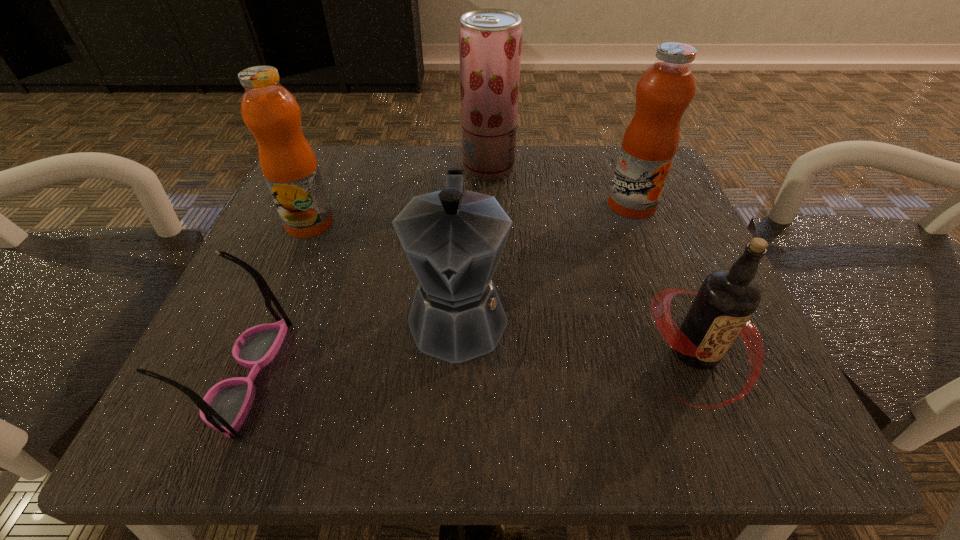
Where is `free space located 0.050m at the spout of the coffeepot`? The width and height of the screenshot is (960, 540). free space located 0.050m at the spout of the coffeepot is located at coordinates (454, 412).

Where is `free location located on the right of the spectacles`? The width and height of the screenshot is (960, 540). free location located on the right of the spectacles is located at coordinates (398, 375).

Find the location of a particular element. Image resolution: width=960 pixels, height=540 pixels. coffeepot located at the near edge is located at coordinates (453, 238).

Where is `root beer located in the near edge section of the desktop`? The height and width of the screenshot is (540, 960). root beer located in the near edge section of the desktop is located at coordinates [x=726, y=300].

Where is `spectacles that is at the near edge`? spectacles that is at the near edge is located at coordinates (224, 408).

This screenshot has height=540, width=960. I want to click on fruit juice located in the left edge section of the desktop, so click(288, 163).

I want to click on spectacles that is positioned at the left edge, so click(x=224, y=408).

Identify the location of fruit juice at the right edge. Image resolution: width=960 pixels, height=540 pixels. (664, 91).

Identify the location of root beer that is at the right edge. The height and width of the screenshot is (540, 960). (726, 300).

The height and width of the screenshot is (540, 960). What are the coordinates of `object at the far left corner` in the screenshot? It's located at (288, 163).